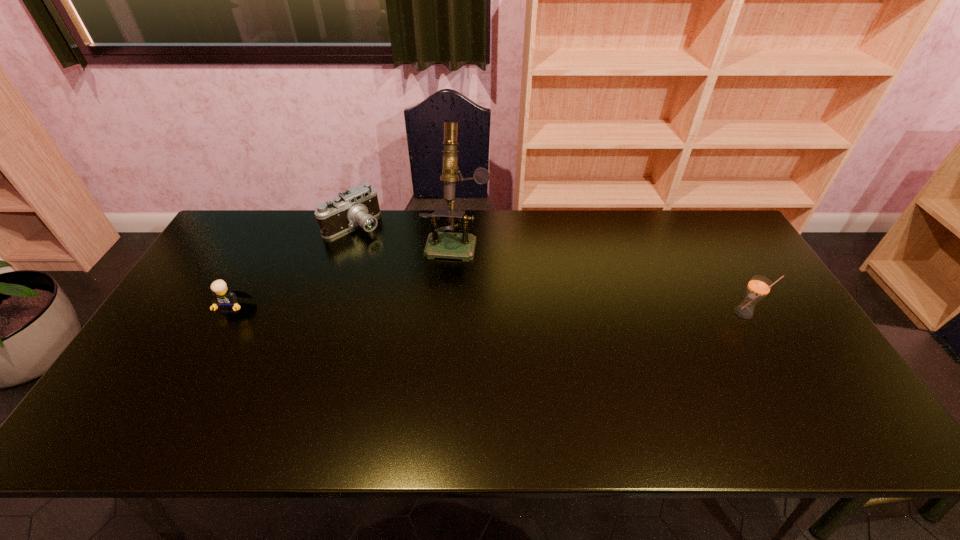
The width and height of the screenshot is (960, 540). I want to click on free space between the third shortest object and the tallest object, so click(600, 276).

Locate an element on the screen. free area in between the leftmost object and the straw is located at coordinates (489, 310).

Where is `empty location between the leftmost object and the second object from left to right`? The image size is (960, 540). empty location between the leftmost object and the second object from left to right is located at coordinates (294, 266).

You are a GUI agent. You are given a task and a screenshot of the screen. Output one action in this format:
    pyautogui.click(x=<x>, y=<y>)
    Task: Click on the free space between the Lego and the second object from left to right
    
    Given the screenshot: What is the action you would take?
    pyautogui.click(x=294, y=266)

Identify which object is located as the second nearest to the camera. Please provide its 2D coordinates. Your answer should be formatted as a tuple, i.e. [(x, y)], where the tuple contains the x and y coordinates of a point satisfying the conditions above.

[(226, 299)]

Point out which object is positioned as the nearest to the Lego. Please provide its 2D coordinates. Your answer should be formatted as a tuple, i.e. [(x, y)], where the tuple contains the x and y coordinates of a point satisfying the conditions above.

[(359, 205)]

Where is `free space in the image that satisfies the following two spatial constraints: 1. on the front side of the third object from right to left; 2. on the right side of the tallest object`? free space in the image that satisfies the following two spatial constraints: 1. on the front side of the third object from right to left; 2. on the right side of the tallest object is located at coordinates (348, 241).

Where is `free space in the image that satisfies the following two spatial constraints: 1. on the front side of the second object from left to right; 2. on the right side of the second tallest object`? The width and height of the screenshot is (960, 540). free space in the image that satisfies the following two spatial constraints: 1. on the front side of the second object from left to right; 2. on the right side of the second tallest object is located at coordinates (324, 313).